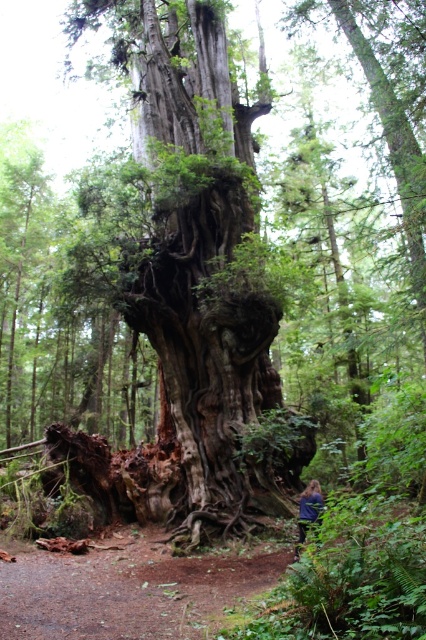
Between point (271, 492) and point (305, 502), which one is positioned in front?

Point (305, 502) is more forward.

Identify the location of rough bark tree trunk at center. (206, 282).